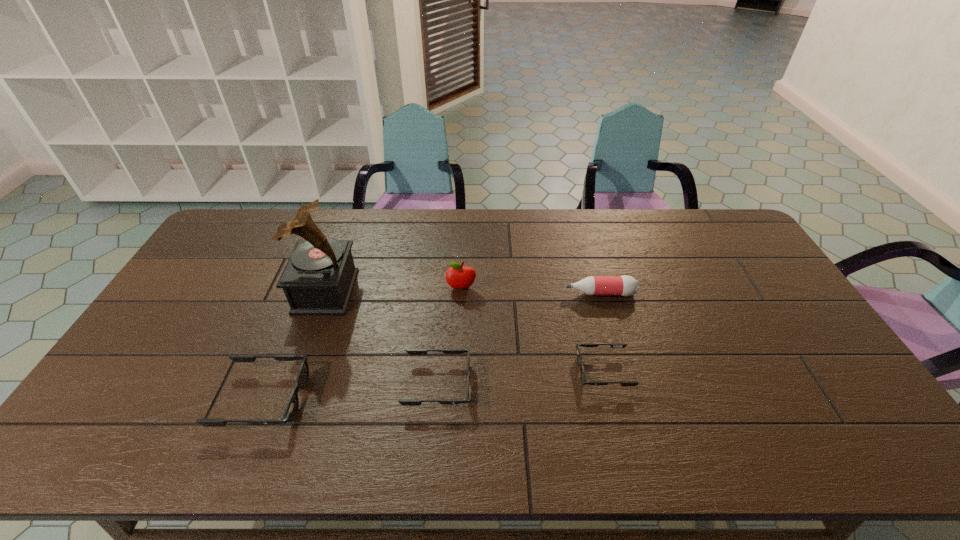
The width and height of the screenshot is (960, 540). Find the location of `vacant area at the left edge of the desktop`. vacant area at the left edge of the desktop is located at coordinates (229, 277).

Find the location of a particular element. vacant space at the right edge of the desktop is located at coordinates (729, 266).

Identify the location of free spot between the tallest object and the second shortest sunglasses. (382, 338).

This screenshot has width=960, height=540. In order to click on empty space between the second tallest object and the phonograph_record in this screenshot , I will do `click(394, 290)`.

This screenshot has width=960, height=540. Identify the location of free area in between the tallest sunglasses and the shortest object. (434, 385).

Where is `vacant area that lies between the second shortest sunglasses and the bottle`? vacant area that lies between the second shortest sunglasses and the bottle is located at coordinates (519, 339).

Locate an element on the screen. Image resolution: width=960 pixels, height=540 pixels. unoccupied area between the leftmost sunglasses and the bottle is located at coordinates (432, 346).

The height and width of the screenshot is (540, 960). I want to click on free space between the apple and the bottle, so click(531, 291).

Locate an element on the screen. This screenshot has height=540, width=960. free space between the second sunglasses from right to left and the leftmost sunglasses is located at coordinates (350, 392).

Where is `vacant space in between the apple and the second tallest sunglasses`? vacant space in between the apple and the second tallest sunglasses is located at coordinates tap(449, 336).